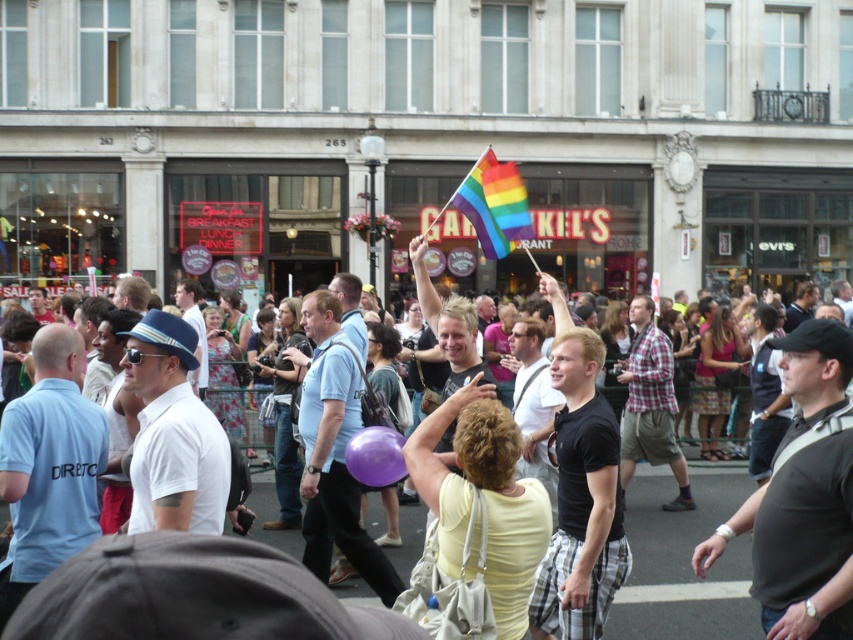
Between point (289, 540) and point (474, 182), which one is positioned in front?

Point (289, 540) is in front.

Can you confirm if rainbow flag at center is bigger than rainbow fabric flag at upper center?

Incorrect, rainbow flag at center is not larger than rainbow fabric flag at upper center.

Describe the element at coordinates (685, 561) in the screenshot. I see `rainbow flag at center` at that location.

Locate an element on the screen. rainbow flag at center is located at coordinates (685, 561).